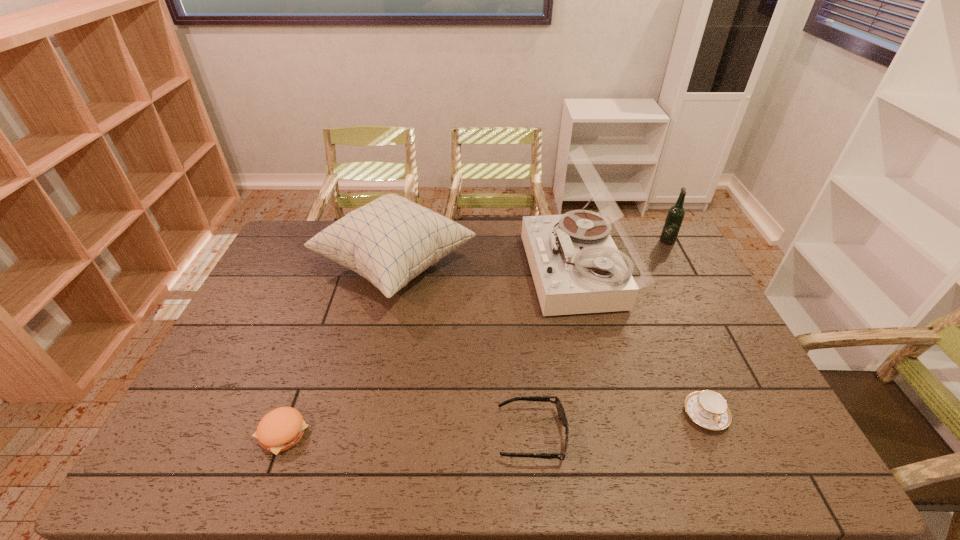
Locate an element on the screen. free space between the sunglasses and the cushion is located at coordinates (464, 350).

In order to click on vacant space in between the teacup and the cushion in this screenshot , I will do `click(550, 340)`.

You are a GUI agent. You are given a task and a screenshot of the screen. Output one action in this format:
    pyautogui.click(x=<x>, y=<y>)
    Task: Click on the empty space between the cushion and the sunglasses
    
    Given the screenshot: What is the action you would take?
    pyautogui.click(x=464, y=350)

This screenshot has width=960, height=540. I want to click on vacant space that's between the record player and the patty, so click(430, 353).

You are a GUI agent. You are given a task and a screenshot of the screen. Output one action in this format:
    pyautogui.click(x=<x>, y=<y>)
    Task: Click on the vacant area that lies between the cushion and the sunglasses
    The image size is (960, 540).
    Given the screenshot: What is the action you would take?
    pyautogui.click(x=464, y=350)

Where is `vacant space that is in between the sunglasses and the teacup`? vacant space that is in between the sunglasses and the teacup is located at coordinates (618, 424).

Find the location of a particular element. The width and height of the screenshot is (960, 540). vacant space that is in between the beer bottle and the patty is located at coordinates (474, 336).

Where is `free spot between the sunglasses and the cushion`? free spot between the sunglasses and the cushion is located at coordinates (464, 350).

This screenshot has height=540, width=960. In order to click on the fourth closest object relative to the cushion in this screenshot , I will do `click(709, 409)`.

Point out which object is positioned as the third nearest to the patty. Please provide its 2D coordinates. Your answer should be formatted as a tuple, i.e. [(x, y)], where the tuple contains the x and y coordinates of a point satisfying the conditions above.

[(576, 267)]